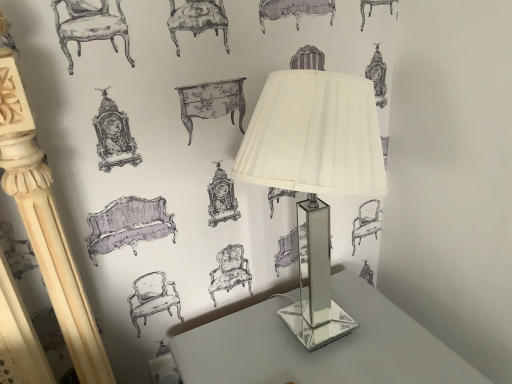
Identify the location of vacant space to the left of clear glass lamp at center. (224, 349).